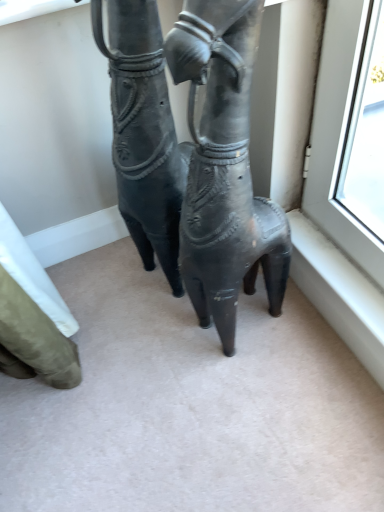
Locate an element on the screen. This screenshot has width=384, height=512. matte black horse at center is located at coordinates (201, 147).

Describe the element at coordinates (201, 147) in the screenshot. I see `matte black horse at center` at that location.

Image resolution: width=384 pixels, height=512 pixels. Find the location of `matte black horse at center`. matte black horse at center is located at coordinates (201, 147).